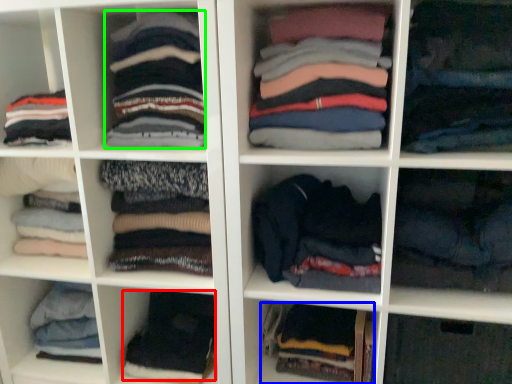
Question: Which object is positioned farthest from clothing (highlighted by a red box)? Select from clothing (highlighted by a blue box) and clothing (highlighted by a green box).

Choices:
 (A) clothing
 (B) clothing

Answer: (B)